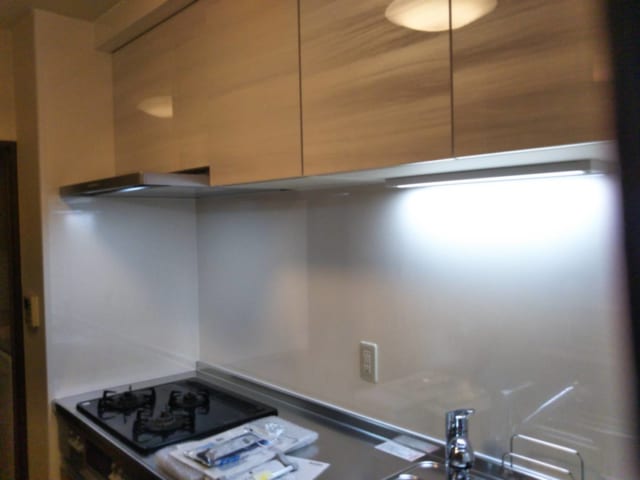
Locate an element on the screen. The width and height of the screenshot is (640, 480). edge of wall is located at coordinates (33, 345).